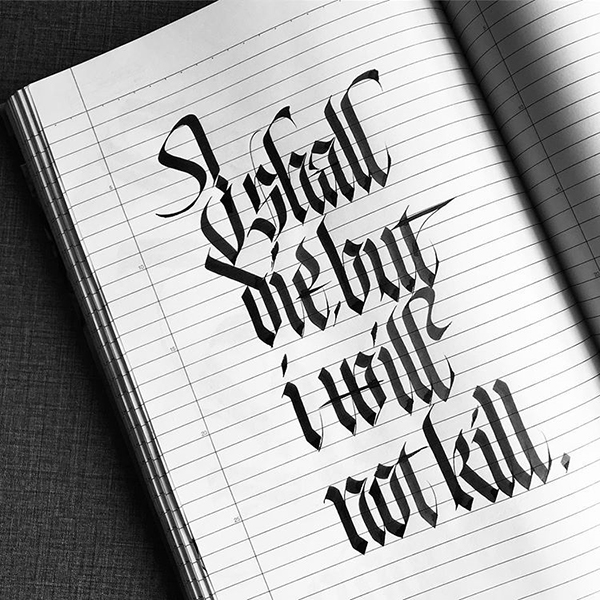
Image resolution: width=600 pixels, height=600 pixels. What are the coordinates of `table` in the screenshot? It's located at (55, 414).